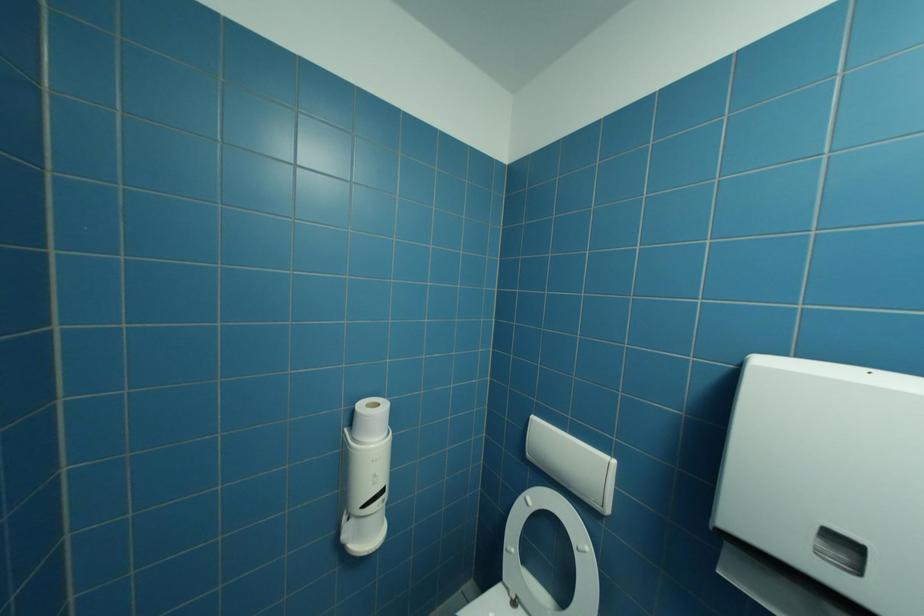
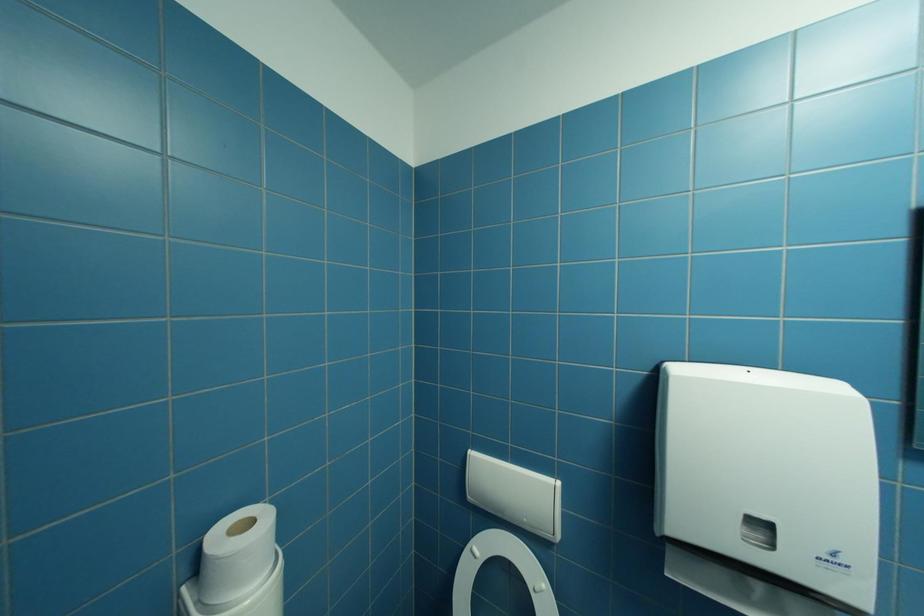
Question: Which direction would the cameraman need to move to produce the second image? Reply with the corresponding letter.

Choices:
 (A) Left
 (B) Right
 (C) Forward
 (D) Backward

Answer: (C)